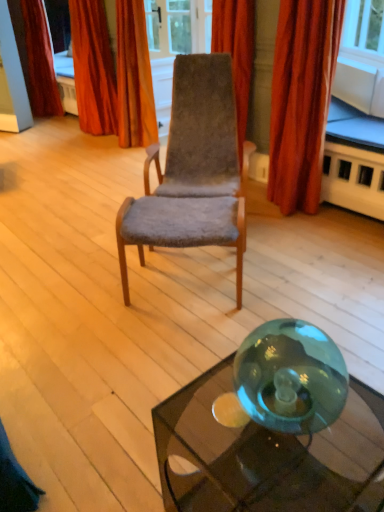
Image resolution: width=384 pixels, height=512 pixels. What do you see at coordinates (93, 68) in the screenshot?
I see `velvet-like red curtain at upper left, positioned as the third curtain in right-to-left order` at bounding box center [93, 68].

The height and width of the screenshot is (512, 384). In order to click on transparent glass table at lower right, which is the 2th table in top-to-bottom order in this screenshot , I will do `click(268, 455)`.

This screenshot has width=384, height=512. Describe the element at coordinates (193, 170) in the screenshot. I see `velvet brown chair at center` at that location.

This screenshot has width=384, height=512. What do you see at coordinates (40, 60) in the screenshot?
I see `velvet-like red curtain at upper left, marked as the first curtain in a left-to-right arrangement` at bounding box center [40, 60].

What do you see at coordinates (301, 100) in the screenshot?
I see `velvet-like red curtain at right, which is counted as the 1th curtain, starting from the right` at bounding box center [301, 100].

This screenshot has width=384, height=512. In order to click on velvet-like red curtain at upper left, positioned as the third curtain in right-to-left order in this screenshot , I will do `click(93, 68)`.

From the image's perspective, which one is positioned higher, velvet brown chair at center or transparent glass table at lower right, the second table viewed from the front?

velvet brown chair at center.

From a real-world perspective, which is physically below, velvet brown chair at center or transparent glass table at lower right, the 2th table viewed from the left?

transparent glass table at lower right, the 2th table viewed from the left, is physically lower.

Considering the sizes of objects transparent glass table at lower right, marked as the second table in a right-to-left arrangement, and transparent glass table at lower right, placed as the 1th table when sorted from back to front, in the image provided, who is taller, transparent glass table at lower right, marked as the second table in a right-to-left arrangement, or transparent glass table at lower right, placed as the 1th table when sorted from back to front,?

Standing taller between the two is transparent glass table at lower right, placed as the 1th table when sorted from back to front.

From the image's perspective, is transparent glass table at lower right, the first table viewed from the front, positioned above or below transparent glass table at lower right, which is counted as the first table, starting from the right?

From the image's perspective, transparent glass table at lower right, the first table viewed from the front, appears below transparent glass table at lower right, which is counted as the first table, starting from the right.

From the picture: How much distance is there between transparent glass table at lower right, which is the 2th table from back to front, and transparent glass table at lower right, the second table viewed from the front?

transparent glass table at lower right, which is the 2th table from back to front, is 5.72 feet from transparent glass table at lower right, the second table viewed from the front.

Does transparent glass table at lower right, which is the 2th table from back to front, contain transparent glass table at lower right, the 2th table viewed from the left?

Definitely not — transparent glass table at lower right, the 2th table viewed from the left, is not inside transparent glass table at lower right, which is the 2th table from back to front.

Does velvet-like red curtain at upper left, which appears as the 2th curtain when viewed from the left, have a lesser width compared to velvet-like red curtain at right, the 4th curtain viewed from the left?

No, velvet-like red curtain at upper left, which appears as the 2th curtain when viewed from the left, is not thinner than velvet-like red curtain at right, the 4th curtain viewed from the left.

Which point is more distant from viewer, (86, 38) or (298, 185)?

Point (86, 38)

Does velvet-like red curtain at upper left, positioned as the third curtain in right-to-left order, turn towards velvet-like red curtain at right, the 4th curtain viewed from the left?

No.

Is velvet-like red curtain at upper left, which appears as the 2th curtain when viewed from the left, at the left side of velvet-like red curtain at right, which is counted as the 1th curtain, starting from the right?

Yes.

Does velvet-like red curtain at right, which is counted as the 1th curtain, starting from the right, have a larger size compared to transparent glass table at lower right, the second table viewed from the front?

Indeed, velvet-like red curtain at right, which is counted as the 1th curtain, starting from the right, has a larger size compared to transparent glass table at lower right, the second table viewed from the front.

Is point (332, 4) closer to viewer compared to point (333, 148)?

Yes, it is in front of point (333, 148).

From the image's perspective, is velvet-like red curtain at right, the 4th curtain viewed from the left, over transparent glass table at lower right, the 2th table viewed from the left?

Yes, from the image's perspective, velvet-like red curtain at right, the 4th curtain viewed from the left, is on top of transparent glass table at lower right, the 2th table viewed from the left.

In the scene shown: Considering the relative sizes of transparent glass table at lower right, the 2th table viewed from the left, and transparent glass table at lower right, the first table viewed from the front, in the image provided, is transparent glass table at lower right, the 2th table viewed from the left, shorter than transparent glass table at lower right, the first table viewed from the front,?

Incorrect, the height of transparent glass table at lower right, the 2th table viewed from the left, does not fall short of that of transparent glass table at lower right, the first table viewed from the front.

Is transparent glass table at lower right, arranged as the first table when viewed from the top, outside of transparent glass table at lower right, the first table viewed from the front?

Yes, transparent glass table at lower right, arranged as the first table when viewed from the top, is located beyond the bounds of transparent glass table at lower right, the first table viewed from the front.

From the picture: Is transparent glass table at lower right, the second table viewed from the front, closer to the viewer compared to transparent glass table at lower right, the 1th table ordered from the bottom?

No.

Considering the positions of point (121, 119) and point (151, 225), is point (121, 119) closer or farther from the camera than point (151, 225)?

Point (121, 119) is farther from the camera than point (151, 225).

Is velvet-like orange curtain at upper center, acting as the 3th curtain starting from the left, placed right next to velvet brown chair at center?

velvet-like orange curtain at upper center, acting as the 3th curtain starting from the left, is not next to velvet brown chair at center, and they're not touching.

Is velvet-like orange curtain at upper center, acting as the 3th curtain starting from the left, looking in the opposite direction of velvet brown chair at center?

No, velvet brown chair at center is not at the back of velvet-like orange curtain at upper center, acting as the 3th curtain starting from the left.

Considering the sizes of objects velvet-like orange curtain at upper center, acting as the 3th curtain starting from the left, and velvet brown chair at center in the image provided, who is taller, velvet-like orange curtain at upper center, acting as the 3th curtain starting from the left, or velvet brown chair at center?

velvet-like orange curtain at upper center, acting as the 3th curtain starting from the left.

The height and width of the screenshot is (512, 384). What are the coordinates of `curtain that is the 2nd one below the velvet-like red curtain at upper left, which appears as the 2th curtain when viewed from the left (from a real-world perspective)` in the screenshot? It's located at (301, 100).

Can you confirm if velvet-like red curtain at right, which is counted as the 1th curtain, starting from the right, is thinner than velvet-like red curtain at upper left, positioned as the third curtain in right-to-left order?

Indeed, velvet-like red curtain at right, which is counted as the 1th curtain, starting from the right, has a lesser width compared to velvet-like red curtain at upper left, positioned as the third curtain in right-to-left order.

Would you say velvet-like red curtain at right, which is counted as the 1th curtain, starting from the right, is a long distance from velvet-like red curtain at upper left, which appears as the 2th curtain when viewed from the left?

Yes, velvet-like red curtain at right, which is counted as the 1th curtain, starting from the right, and velvet-like red curtain at upper left, which appears as the 2th curtain when viewed from the left, are quite far apart.

Is velvet-like red curtain at right, which is counted as the 1th curtain, starting from the right, taller or shorter than velvet-like red curtain at upper left, positioned as the third curtain in right-to-left order?

In the image, velvet-like red curtain at right, which is counted as the 1th curtain, starting from the right, appears to be shorter than velvet-like red curtain at upper left, positioned as the third curtain in right-to-left order.

There is a transparent glass table at lower right, arranged as the first table when viewed from the top. What are the coordinates of `chair above it (from a real-world perspective)` in the screenshot? It's located at (193, 170).

At what (x,y) coordinates should I click in order to perform the action: click on table behind the transparent glass table at lower right, which is the 2th table from back to front. Please return your answer as a coordinate pair (x, y). The height and width of the screenshot is (512, 384). Looking at the image, I should click on (355, 165).

Based on their spatial positions, is velvet-like red curtain at upper left, which appears as the 2th curtain when viewed from the left, or transparent glass table at lower right, marked as the second table in a right-to-left arrangement, closer to transparent glass table at lower right, the 2th table viewed from the left?

Based on the image, transparent glass table at lower right, marked as the second table in a right-to-left arrangement, appears to be nearer to transparent glass table at lower right, the 2th table viewed from the left.

Estimate the real-world distances between objects in this image. Which object is closer to transparent glass table at lower right, the first table from the left, velvet brown chair at center or velvet-like red curtain at upper left, marked as the first curtain in a left-to-right arrangement?

Result: velvet brown chair at center lies closer to transparent glass table at lower right, the first table from the left, than the other object.

Estimate the real-world distances between objects in this image. Which object is further from transparent glass table at lower right, placed as the 1th table when sorted from back to front, velvet-like red curtain at upper left, arranged as the fourth curtain when viewed from the right, or velvet-like red curtain at upper left, positioned as the third curtain in right-to-left order?

Among the two, velvet-like red curtain at upper left, arranged as the fourth curtain when viewed from the right, is located further to transparent glass table at lower right, placed as the 1th table when sorted from back to front.

Considering their positions, is velvet-like orange curtain at upper center, acting as the 3th curtain starting from the left, positioned further to velvet-like red curtain at right, which is counted as the 1th curtain, starting from the right, than velvet-like red curtain at upper left, marked as the first curtain in a left-to-right arrangement?

velvet-like red curtain at upper left, marked as the first curtain in a left-to-right arrangement, is further to velvet-like red curtain at right, which is counted as the 1th curtain, starting from the right.

Considering their positions, is velvet brown chair at center positioned further to velvet-like red curtain at upper left, marked as the first curtain in a left-to-right arrangement, than velvet-like red curtain at upper left, which appears as the 2th curtain when viewed from the left?

Based on the image, velvet brown chair at center appears to be further to velvet-like red curtain at upper left, marked as the first curtain in a left-to-right arrangement.

Based on their spatial positions, is transparent glass table at lower right, the first table from the left, or velvet-like orange curtain at upper center, marked as the second curtain in a right-to-left arrangement, further from velvet-like red curtain at right, which is counted as the 1th curtain, starting from the right?

velvet-like orange curtain at upper center, marked as the second curtain in a right-to-left arrangement.

From the picture: Looking at the image, which one is located further to transparent glass table at lower right, placed as the 1th table when sorted from back to front, velvet brown chair at center or velvet-like red curtain at right, the 4th curtain viewed from the left?

velvet brown chair at center lies further to transparent glass table at lower right, placed as the 1th table when sorted from back to front, than the other object.

From the image, which object appears to be nearer to transparent glass table at lower right, placed as the 1th table when sorted from back to front, velvet-like red curtain at right, the 4th curtain viewed from the left, or transparent glass table at lower right, which is the 2th table from back to front?

The object closer to transparent glass table at lower right, placed as the 1th table when sorted from back to front, is velvet-like red curtain at right, the 4th curtain viewed from the left.

Where is `chair between velvet-like red curtain at right, the 4th curtain viewed from the left, and transparent glass table at lower right, the 1th table ordered from the bottom, vertically`? chair between velvet-like red curtain at right, the 4th curtain viewed from the left, and transparent glass table at lower right, the 1th table ordered from the bottom, vertically is located at coordinates (193, 170).

The image size is (384, 512). What are the coordinates of `table between transparent glass table at lower right, the first table viewed from the front, and velvet-like red curtain at upper left, arranged as the fourth curtain when viewed from the right, from front to back` in the screenshot? It's located at (355, 165).

Find the location of `curtain between velvet-like red curtain at right, the 4th curtain viewed from the left, and velvet-like red curtain at upper left, positioned as the third curtain in right-to-left order, in the front-back direction`. curtain between velvet-like red curtain at right, the 4th curtain viewed from the left, and velvet-like red curtain at upper left, positioned as the third curtain in right-to-left order, in the front-back direction is located at coordinates (134, 77).

The image size is (384, 512). In order to click on table between transparent glass table at lower right, marked as the second table in a right-to-left arrangement, and velvet-like orange curtain at upper center, acting as the 3th curtain starting from the left, from front to back in this screenshot , I will do `click(355, 165)`.